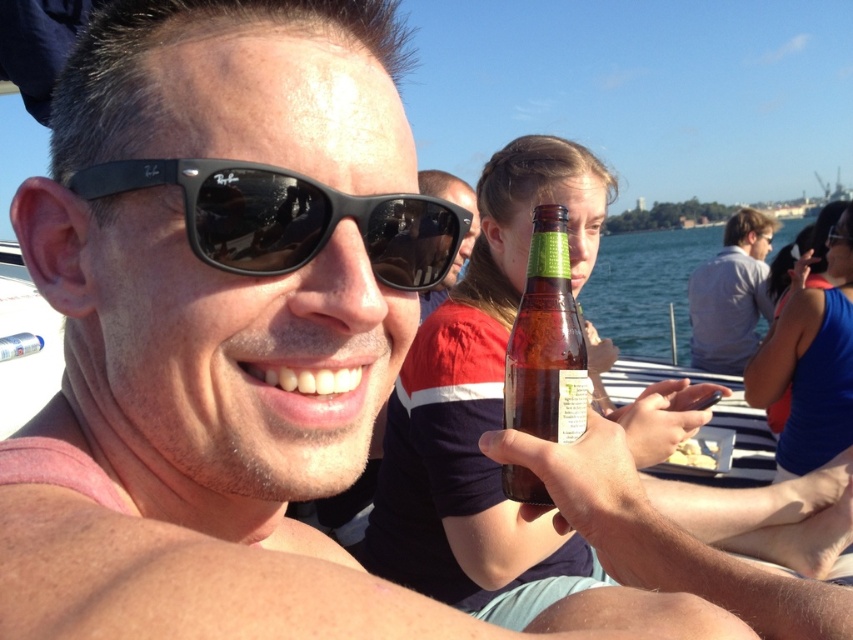
You are a photographer trying to capture a closeup of the matte black sunglasses at center and the white plastic bottle at upper left. Which object should you zoom in more on to ensure both are in focus?

The matte black sunglasses at center is larger in size compared to the white plastic bottle at upper left, so you should zoom in more on the matte black sunglasses at center to ensure both are in focus.

You are standing at the origin point in the scene. There are two points marked as point 1 at coordinates (556, 410) and point 2 at coordinates (465, 204). Which point is closer to you?

Point 1 at coordinates (556, 410) is in front of point 2 at coordinates (465, 204), so point 1 is closer to you.

You are a photographer taking a picture of the brown glass bottle at center and the matte black sunglasses at center. Which object should you zoom in on to make them appear larger in the photo?

The brown glass bottle at center is smaller than the matte black sunglasses at center, so you should zoom in on the brown glass bottle at center to make it appear larger in the photo.